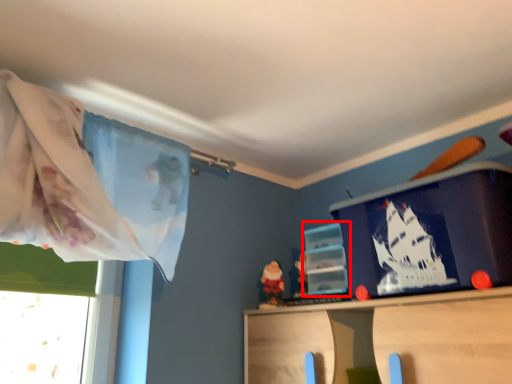
Question: Where is shelf (annotated by the red box) located in relation to window screen in the image?

Choices:
 (A) right
 (B) left

Answer: (B)